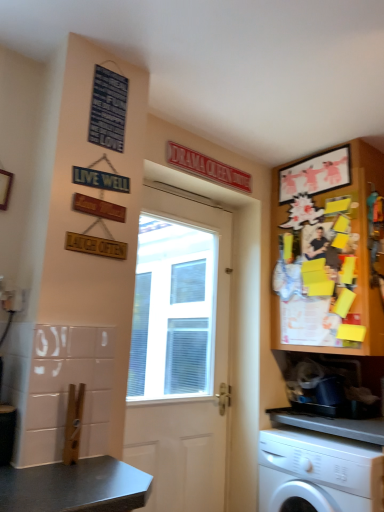
Question: Is white plastic washing machine at lower right situated inside wooden bulletin board at upper right or outside?

Choices:
 (A) inside
 (B) outside

Answer: (B)

Question: From a real-world perspective, is white plastic washing machine at lower right positioned above or below wooden bulletin board at upper right?

Choices:
 (A) above
 (B) below

Answer: (B)

Question: Which object is the farthest from the wooden bulletin board at upper right?

Choices:
 (A) white wooden door at center
 (B) white plastic washing machine at lower right

Answer: (A)

Question: Estimate the real-world distances between objects in this image. Which object is closer to the white wooden door at center?

Choices:
 (A) white plastic washing machine at lower right
 (B) wooden bulletin board at upper right

Answer: (B)